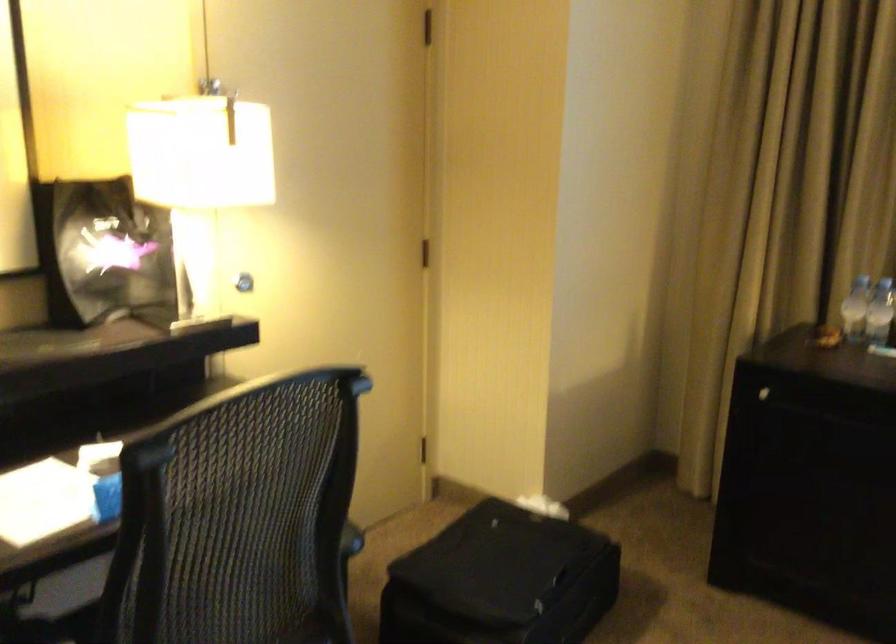
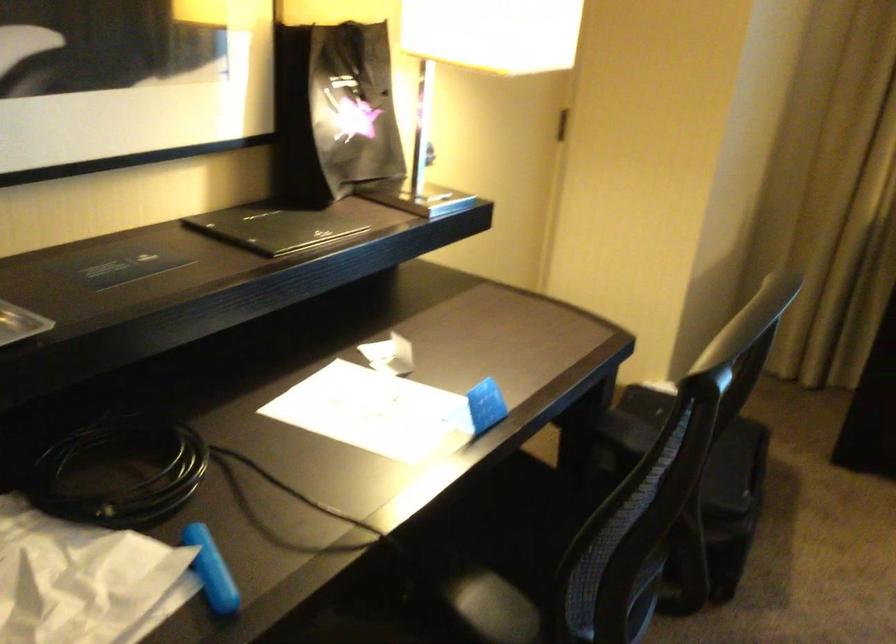
Question: How did the camera likely rotate?

Choices:
 (A) Left
 (B) Right
 (C) Up
 (D) Down

Answer: (D)